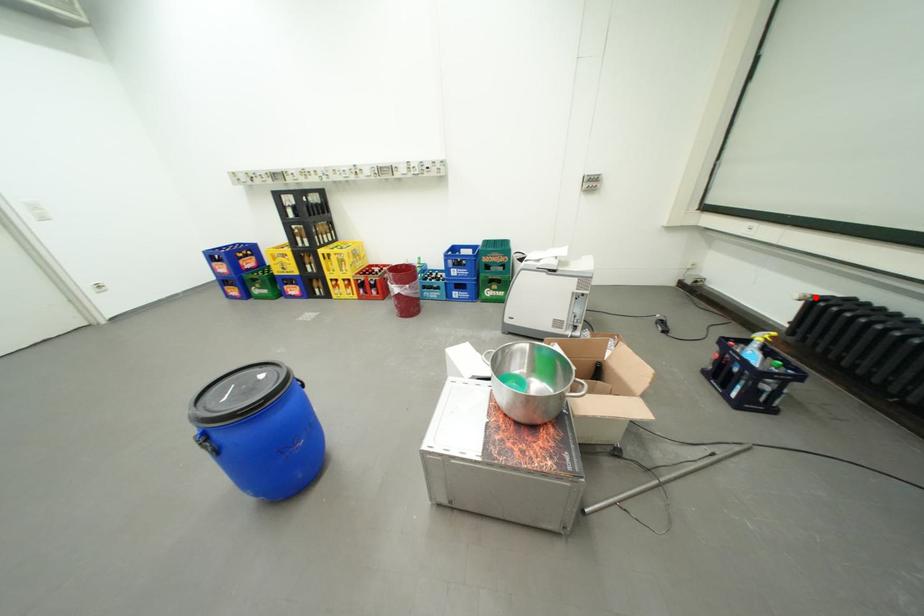
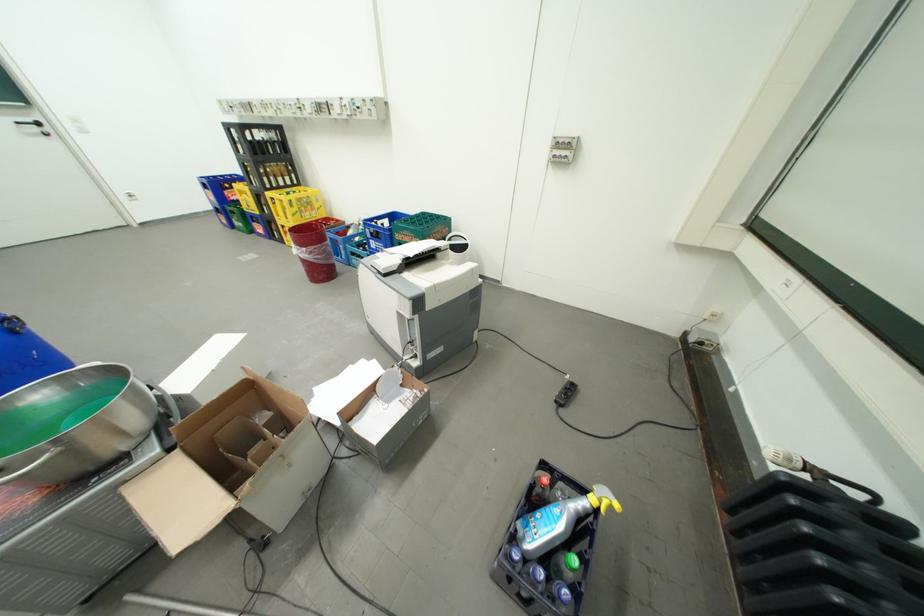
Question: I am providing you with two images of the same scene from different viewpoints. A red point is marked on the first image. Can you still see the location of the red point in image 2?

Choices:
 (A) Yes
 (B) No

Answer: (A)